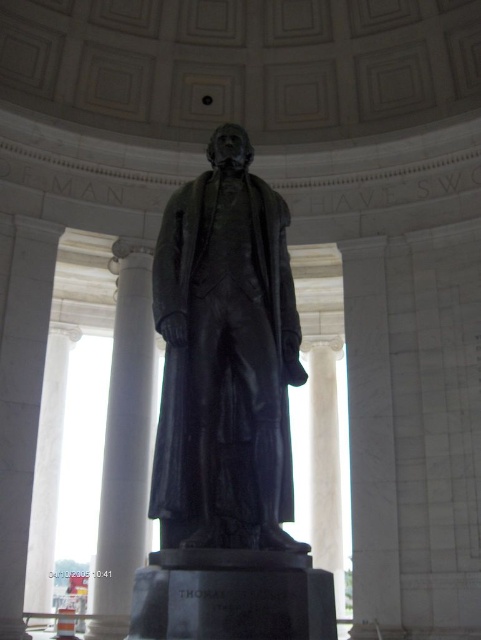
Is black polished statue at center shorter than white marble column at center?

Yes, black polished statue at center is shorter than white marble column at center.

Does point (256, 198) lie in front of point (137, 528)?

Yes, it is in front of point (137, 528).

This screenshot has height=640, width=481. Identify the location of black polished statue at center. (225, 358).

Find the location of `black polished statue at center`. black polished statue at center is located at coordinates (225, 358).